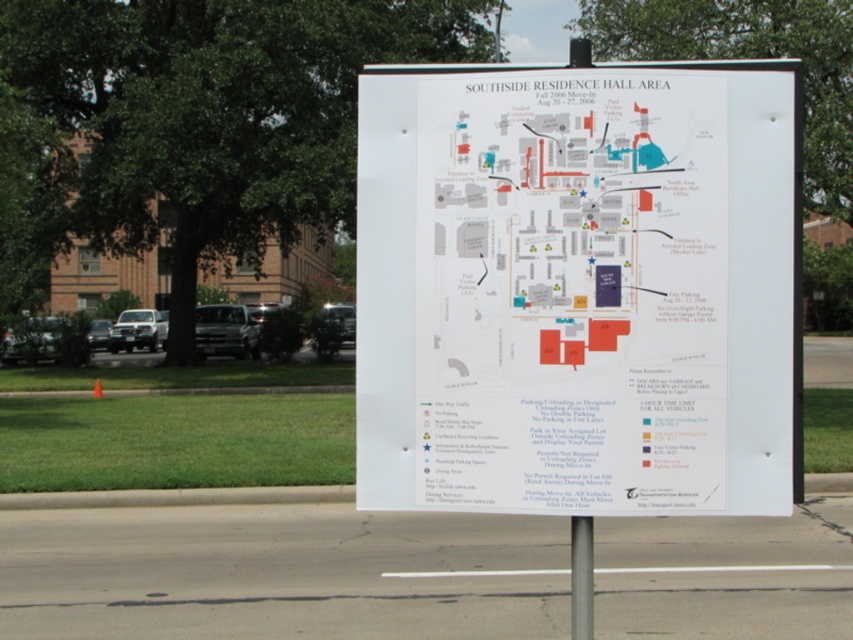
You are a visitor trying to locate the parking area near the Southside Residence Hall. You see the white paper map at center and the metallic pole at lower center. Which object is taller?

The white paper map at center is much taller than the metallic pole at lower center.

You are holding a measuring tape and need to determine if the white paper map at center can be moved closer to the metallic pole at lower center without violating a 50 cm minimum distance requirement. Can you confirm if the current distance meets this requirement?

The distance between the white paper map at center and the metallic pole at lower center is currently 59.09 centimeters, which exceeds the 50 cm minimum requirement. Therefore, moving it closer would violate the requirement, so it should remain at its current position.